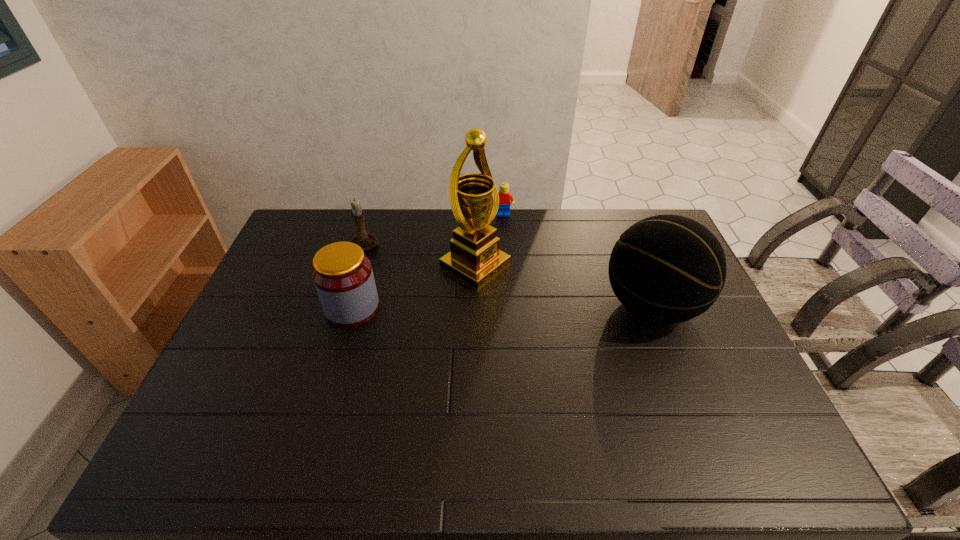
At what (x,y) coordinates should I click in order to perform the action: click on vacant space positioned on the side of the candle holder with the handle. Please return your answer as a coordinate pair (x, y). Looking at the image, I should click on (408, 272).

The height and width of the screenshot is (540, 960). Find the location of `blank space located on the side of the candle holder with the handle`. blank space located on the side of the candle holder with the handle is located at coordinates (412, 274).

The width and height of the screenshot is (960, 540). In order to click on free space located 0.200m on the front-facing side of the award in this screenshot , I will do `click(554, 312)`.

Locate an element on the screen. The image size is (960, 540). free space located 0.190m on the front-facing side of the award is located at coordinates (551, 310).

The image size is (960, 540). I want to click on free space located 0.060m on the front-facing side of the award, so click(x=517, y=291).

At what (x,y) coordinates should I click in order to perform the action: click on free space located on the face of the farthest object. Please return your answer as a coordinate pair (x, y). Image resolution: width=960 pixels, height=540 pixels. Looking at the image, I should click on (505, 233).

Identify the location of free space located 0.170m on the face of the farthest object. (507, 245).

Locate an element on the screen. The width and height of the screenshot is (960, 540). vacant space located on the face of the farthest object is located at coordinates (506, 240).

At what (x,y) coordinates should I click in order to perform the action: click on candle holder present at the far edge. Please return your answer as a coordinate pair (x, y). The height and width of the screenshot is (540, 960). Looking at the image, I should click on (366, 240).

You are a GUI agent. You are given a task and a screenshot of the screen. Output one action in this format:
    pyautogui.click(x=<x>, y=<y>)
    Task: Click on the award situated at the far edge
    Image resolution: width=960 pixels, height=540 pixels.
    Given the screenshot: What is the action you would take?
    pyautogui.click(x=474, y=258)